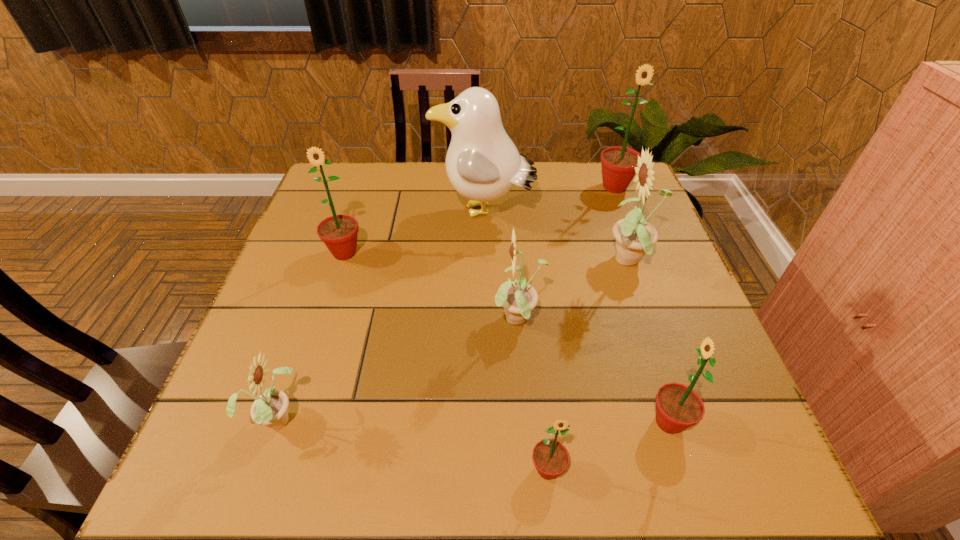
This screenshot has height=540, width=960. In order to click on the smallest yellow sunflower in this screenshot , I will do `click(270, 408)`.

Where is `the leftmost yellow sunflower`? The image size is (960, 540). the leftmost yellow sunflower is located at coordinates (270, 408).

Identify the location of the third green sunflower from right to left. (550, 457).

This screenshot has width=960, height=540. Identify the location of the nearest object. (550, 457).

Locate an element on the screen. This screenshot has height=540, width=960. vacant space located on the face of the biggest green sunflower is located at coordinates (631, 229).

This screenshot has height=540, width=960. Identify the location of free region located on the beak of the white gull. (330, 213).

In order to click on vacant point located 0.230m on the beak of the white gull in this screenshot , I will do `click(351, 213)`.

Where is `blank area located 0.150m on the beak of the white gull`? blank area located 0.150m on the beak of the white gull is located at coordinates (380, 213).

Locate an element on the screen. This screenshot has height=540, width=960. blank space located 0.170m on the front-facing side of the farthest yellow sunflower is located at coordinates (533, 262).

Locate an element on the screen. blank space located on the front-facing side of the farthest yellow sunflower is located at coordinates (516, 262).